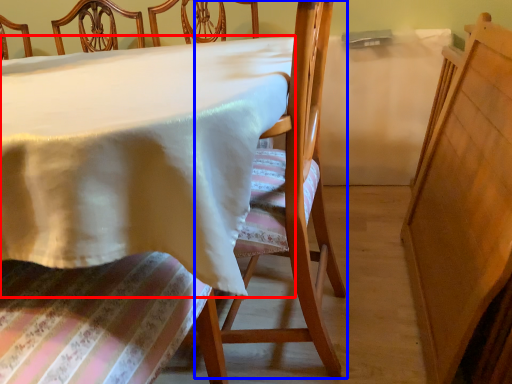
Question: Among these objects, which one is farthest to the camera, table (highlighted by a red box) or chair (highlighted by a blue box)?

Choices:
 (A) table
 (B) chair

Answer: (B)